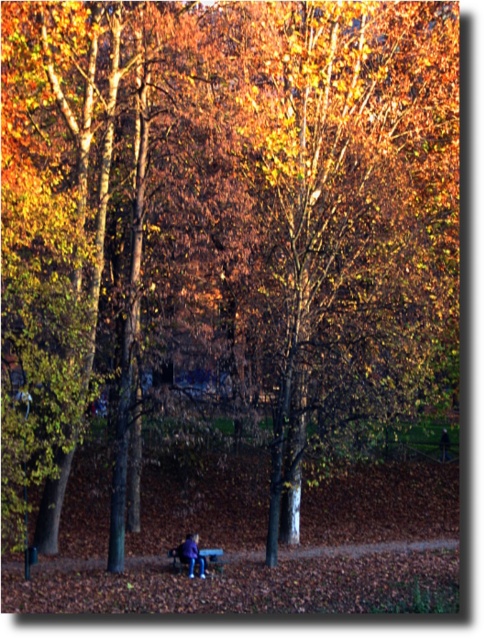
Question: Which of the following is the closest to the observer?

Choices:
 (A) golden-brown bark tree at center
 (B) wooden park bench at lower center
 (C) blue denim jeans at lower center

Answer: (A)

Question: Is golden-brown bark tree at center below blue denim jeans at lower center?

Choices:
 (A) yes
 (B) no

Answer: (B)

Question: Is golden-brown bark tree at center above blue denim jeans at lower center?

Choices:
 (A) no
 (B) yes

Answer: (B)

Question: Which point is farther to the camera?

Choices:
 (A) (277, 273)
 (B) (178, 552)

Answer: (A)

Question: Estimate the real-world distances between objects in this image. Which object is farther from the golden-brown bark tree at center?

Choices:
 (A) blue denim jeans at lower center
 (B) wooden park bench at lower center

Answer: (A)

Question: Is golden-brown bark tree at center thinner than blue denim jeans at lower center?

Choices:
 (A) no
 (B) yes

Answer: (A)